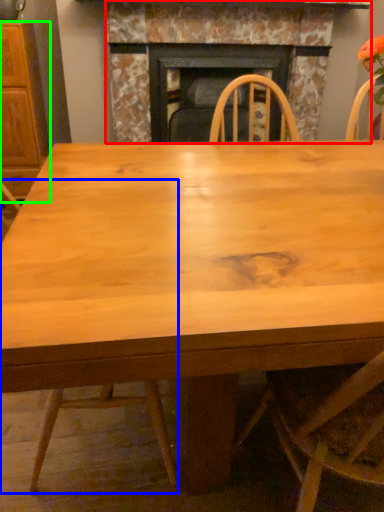
Question: Considering the real-world distances, which object is closest to fireplace (highlighted by a red box)? chair (highlighted by a blue box) or cabinetry (highlighted by a green box).

Choices:
 (A) chair
 (B) cabinetry

Answer: (B)